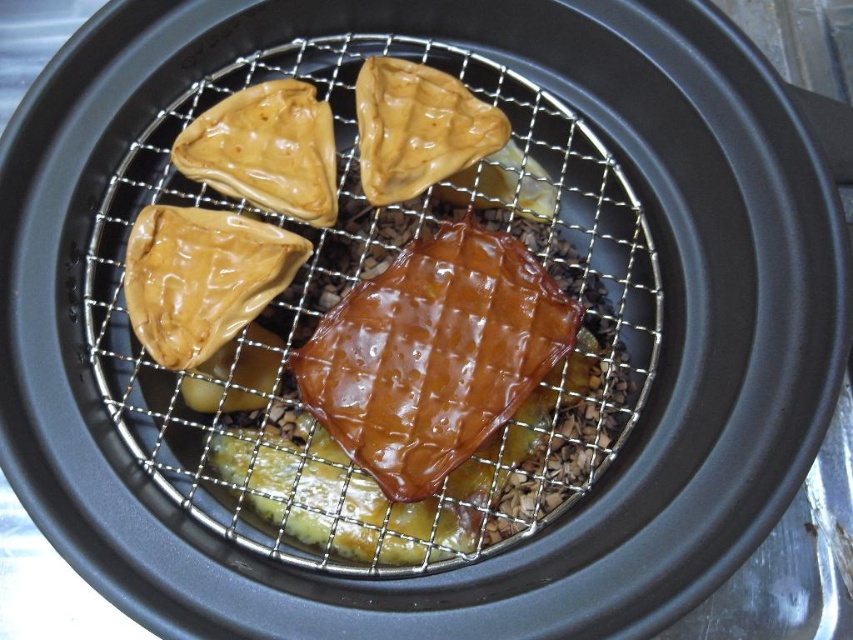
You are a chef preparing to serve two dishes from the grill. You have a shiny brown waffle at center and a glossy brown pastry at upper left. Which dish should you choose if you want to serve the larger one?

The shiny brown waffle at center is larger in size than the glossy brown pastry at upper left, so you should choose the shiny brown waffle at center to serve the larger one.

You are a food delivery person who needs to place a new order on the grill. The new order requires placing a 3.5 inch wide burger patty between the shiny brown waffle at center and the glossy brown pastry at upper left. Is there enough space between them to fit the burger patty without overlapping?

The distance between the shiny brown waffle at center and the glossy brown pastry at upper left is 7.12 inches, and the burger patty is 3.5 inches wide. Since 3.5 inches is less than 7.12 inches, there is enough space to place the burger patty between them without overlapping.